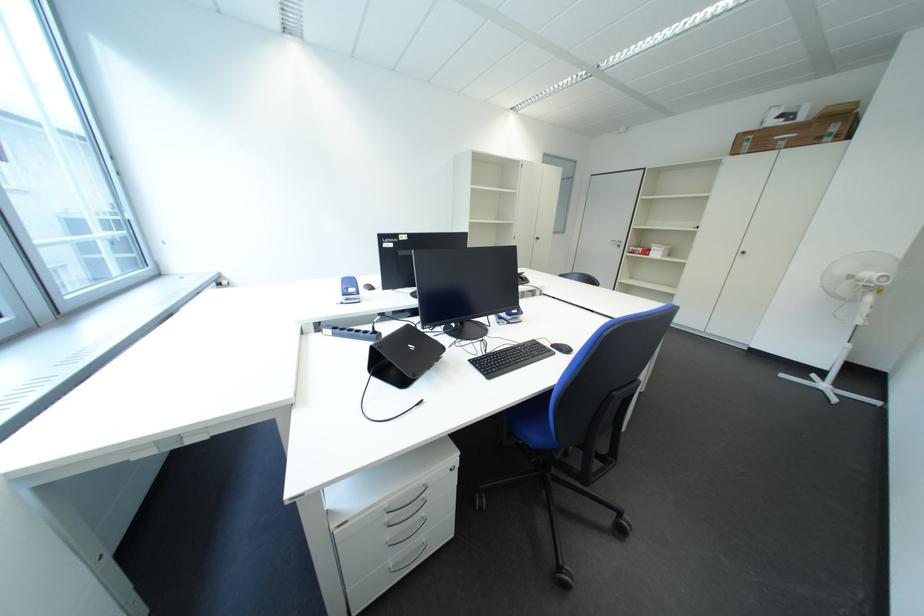
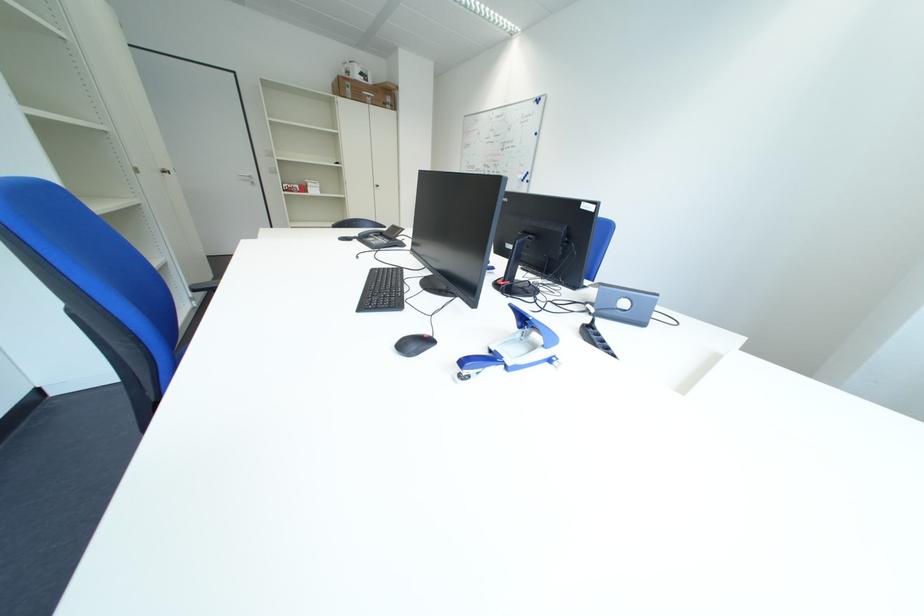
The point at (759, 147) is marked in the first image. Where is the corresponding point in the second image?

(360, 92)